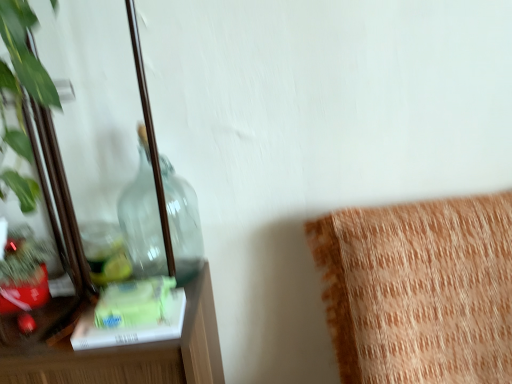
Locate an element on the screen. orange textured cushion at upper right is located at coordinates (419, 290).

Find the location of a particular element. The height and width of the screenshot is (384, 512). clear glass mirror at left is located at coordinates (61, 186).

Are transparent glass bottle at left and clear glass mirror at left far apart?

No, transparent glass bottle at left is not far away from clear glass mirror at left.

Choose the correct answer: Is transparent glass bottle at left inside clear glass mirror at left or outside it?

The correct answer is: inside.

From the image's perspective, is transparent glass bottle at left positioned above or below clear glass mirror at left?

Clearly, from the image's perspective, transparent glass bottle at left is below clear glass mirror at left.

Considering the relative sizes of transparent glass bottle at left and clear glass mirror at left in the image provided, is transparent glass bottle at left wider than clear glass mirror at left?

No, transparent glass bottle at left is not wider than clear glass mirror at left.

Measure the distance between clear glass mirror at left and transparent glass bottle at left.

A distance of 4.39 inches exists between clear glass mirror at left and transparent glass bottle at left.

Is clear glass mirror at left oriented away from transparent glass bottle at left?

Yes, transparent glass bottle at left is at the back of clear glass mirror at left.

From a real-world perspective, is clear glass mirror at left located beneath transparent glass bottle at left?

Incorrect, from a real-world perspective, clear glass mirror at left is higher than transparent glass bottle at left.

Is point (142, 106) farther from viewer compared to point (182, 272)?

No, it is in front of (182, 272).

Considering the sizes of objects orange textured cushion at upper right and clear glass mirror at left in the image provided, who is taller, orange textured cushion at upper right or clear glass mirror at left?

orange textured cushion at upper right is taller.

Is orange textured cushion at upper right not near clear glass mirror at left?

No.

Does orange textured cushion at upper right have a smaller size compared to clear glass mirror at left?

No, orange textured cushion at upper right is not smaller than clear glass mirror at left.

Based on the photo, does orange textured cushion at upper right turn towards clear glass mirror at left?

No, orange textured cushion at upper right is not oriented towards clear glass mirror at left.

From the image's perspective, is transparent glass bottle at left below orange textured cushion at upper right?

Incorrect, from the image's perspective, transparent glass bottle at left is higher than orange textured cushion at upper right.

Does transparent glass bottle at left have a lesser width compared to orange textured cushion at upper right?

Correct, the width of transparent glass bottle at left is less than that of orange textured cushion at upper right.

From a real-world perspective, is transparent glass bottle at left positioned over orange textured cushion at upper right based on gravity?

Correct, in the physical world, transparent glass bottle at left is higher than orange textured cushion at upper right.

Would you say transparent glass bottle at left is a long distance from orange textured cushion at upper right?

Actually, transparent glass bottle at left and orange textured cushion at upper right are a little close together.

Between clear glass mirror at left and orange textured cushion at upper right, which one has smaller size?

clear glass mirror at left is smaller.

Between clear glass mirror at left and orange textured cushion at upper right, which one has smaller width?

Thinner between the two is clear glass mirror at left.

Does clear glass mirror at left lie behind orange textured cushion at upper right?

No, it is not.

Where is `furniture that is on the right side of clear glass mirror at left`? furniture that is on the right side of clear glass mirror at left is located at coordinates coord(419,290).

Measure the distance between orange textured cushion at upper right and transparent glass bottle at left.

A distance of 19.07 inches exists between orange textured cushion at upper right and transparent glass bottle at left.

From the image's perspective, which is above, orange textured cushion at upper right or transparent glass bottle at left?

transparent glass bottle at left is shown above in the image.

From a real-world perspective, is orange textured cushion at upper right on transparent glass bottle at left?

No.

Consider the image. Which of these two, orange textured cushion at upper right or transparent glass bottle at left, is thinner?

transparent glass bottle at left is thinner.

Locate an element on the screen. bottle that appears below the clear glass mirror at left (from the image's perspective) is located at coordinates (142, 217).

Identify the location of bottle behind the clear glass mirror at left. This screenshot has width=512, height=384. (142, 217).

Estimate the real-world distances between objects in this image. Which object is further from orange textured cushion at upper right, clear glass mirror at left or transparent glass bottle at left?

clear glass mirror at left is positioned further to the anchor orange textured cushion at upper right.

When comparing their distances from clear glass mirror at left, does orange textured cushion at upper right or transparent glass bottle at left seem further?

orange textured cushion at upper right is further to clear glass mirror at left.

From the image, which object appears to be farther from orange textured cushion at upper right, transparent glass bottle at left or clear glass mirror at left?

clear glass mirror at left is further to orange textured cushion at upper right.

Considering their positions, is orange textured cushion at upper right positioned closer to transparent glass bottle at left than clear glass mirror at left?

Among the two, clear glass mirror at left is located nearer to transparent glass bottle at left.

When comparing their distances from transparent glass bottle at left, does clear glass mirror at left or orange textured cushion at upper right seem further?

orange textured cushion at upper right is further to transparent glass bottle at left.

Considering their positions, is transparent glass bottle at left positioned closer to clear glass mirror at left than orange textured cushion at upper right?

Among the two, transparent glass bottle at left is located nearer to clear glass mirror at left.

In order to click on bottle situated between clear glass mirror at left and orange textured cushion at upper right from left to right in this screenshot , I will do `click(142, 217)`.